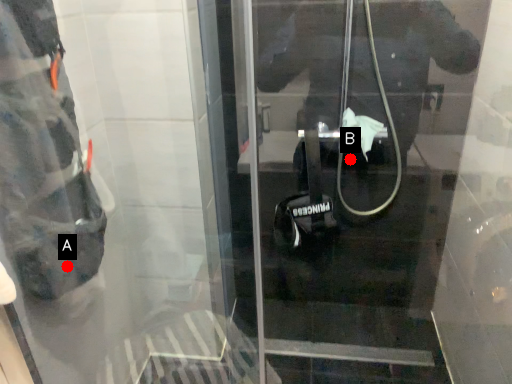
Question: Two points are circled on the image, labeled by A and B beside each circle. Which point appears closest to the camera in this image?

Choices:
 (A) A is closer
 (B) B is closer

Answer: (A)